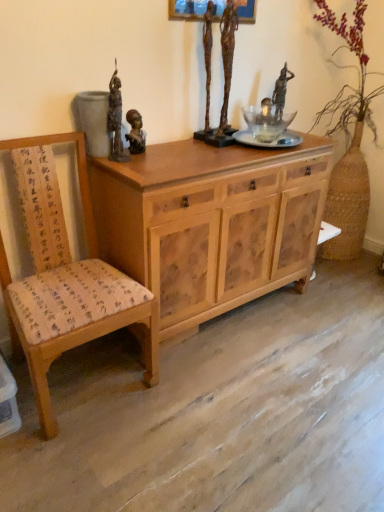
Find the location of a particular element. The width and height of the screenshot is (384, 512). free location to the right of bronze statue at upper left, which ranks as the 2th sculpture in right-to-left order is located at coordinates (164, 157).